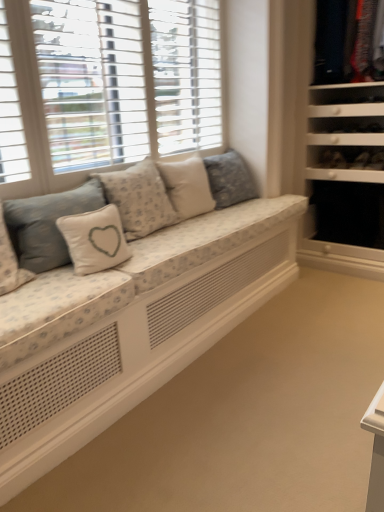
Question: Which direction should I rotate to look at white fabric pillow with heart design at center, which is the 5th pillow in right-to-left order?

Choices:
 (A) right
 (B) left

Answer: (B)

Question: Is white fabric pillow with heart design at center, the 4th pillow in the right-to-left sequence, positioned with its back to white fabric pillow at center, arranged as the second pillow when viewed from the right?

Choices:
 (A) yes
 (B) no

Answer: (B)

Question: Would you say white fabric pillow with heart design at center, which is the second pillow in left-to-right order, is a long distance from white fabric pillow at center, positioned as the fourth pillow in left-to-right order?

Choices:
 (A) no
 (B) yes

Answer: (A)

Question: From the image's perspective, would you say white fabric pillow with heart design at center, the 4th pillow in the right-to-left sequence, is shown under white fabric pillow at center, positioned as the fourth pillow in left-to-right order?

Choices:
 (A) yes
 (B) no

Answer: (A)

Question: Does white fabric pillow with heart design at center, which is the second pillow in left-to-right order, have a smaller size compared to white fabric pillow at center, arranged as the second pillow when viewed from the right?

Choices:
 (A) yes
 (B) no

Answer: (A)

Question: Does white fabric pillow with heart design at center, which is the second pillow in left-to-right order, have a greater width compared to white fabric pillow at center, arranged as the second pillow when viewed from the right?

Choices:
 (A) yes
 (B) no

Answer: (B)

Question: Is white fabric pillow with heart design at center, the 4th pillow in the right-to-left sequence, positioned in front of white fabric pillow at center, positioned as the fourth pillow in left-to-right order?

Choices:
 (A) no
 (B) yes

Answer: (B)

Question: Is white fabric pillow with heart design at center, placed as the 1th pillow when sorted from left to right, thinner than white fabric pillow at center, positioned as the 3th pillow in left-to-right order?

Choices:
 (A) no
 (B) yes

Answer: (B)

Question: Considering the relative sizes of white fabric pillow with heart design at center, which is the 5th pillow in right-to-left order, and white fabric pillow at center, positioned as the 3th pillow in left-to-right order, in the image provided, is white fabric pillow with heart design at center, which is the 5th pillow in right-to-left order, bigger than white fabric pillow at center, positioned as the 3th pillow in left-to-right order,?

Choices:
 (A) yes
 (B) no

Answer: (B)

Question: Is white fabric pillow with heart design at center, which is the 5th pillow in right-to-left order, oriented away from white fabric pillow at center, positioned as the 3th pillow in left-to-right order?

Choices:
 (A) no
 (B) yes

Answer: (A)

Question: From the image's perspective, would you say white fabric pillow with heart design at center, which is the 5th pillow in right-to-left order, is positioned over white fabric pillow at center, positioned as the 3th pillow in left-to-right order?

Choices:
 (A) yes
 (B) no

Answer: (B)

Question: Is white fabric pillow with heart design at center, which is the 5th pillow in right-to-left order, closer to camera compared to white fabric pillow at center, the third pillow positioned from the right?

Choices:
 (A) no
 (B) yes

Answer: (B)

Question: From the image's perspective, does white fabric pillow with heart design at center, placed as the 1th pillow when sorted from left to right, appear lower than white fabric pillow at center, positioned as the 3th pillow in left-to-right order?

Choices:
 (A) yes
 (B) no

Answer: (A)

Question: Are fluffy white pillow at center, which is the first pillow from right to left, and black fabric drawer at right located far from each other?

Choices:
 (A) no
 (B) yes

Answer: (A)